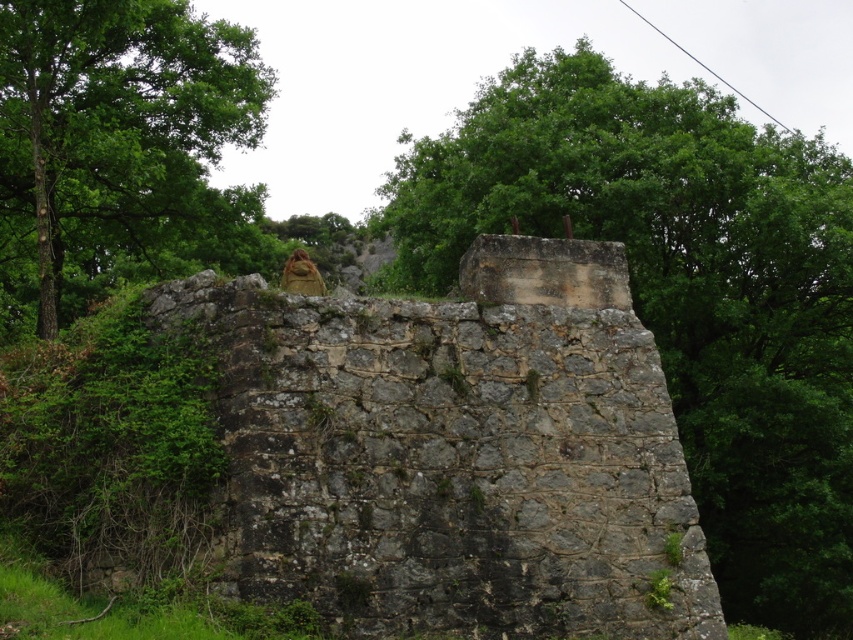
Question: Is green leafy tree at upper center positioned at the back of green leafy tree at upper left?

Choices:
 (A) no
 (B) yes

Answer: (A)

Question: Which point is farther to the camera?

Choices:
 (A) (222, 67)
 (B) (437, 186)

Answer: (B)

Question: Is green leafy tree at upper center in front of green leafy tree at upper left?

Choices:
 (A) yes
 (B) no

Answer: (A)

Question: Is green leafy tree at upper center smaller than green leafy tree at upper left?

Choices:
 (A) no
 (B) yes

Answer: (A)